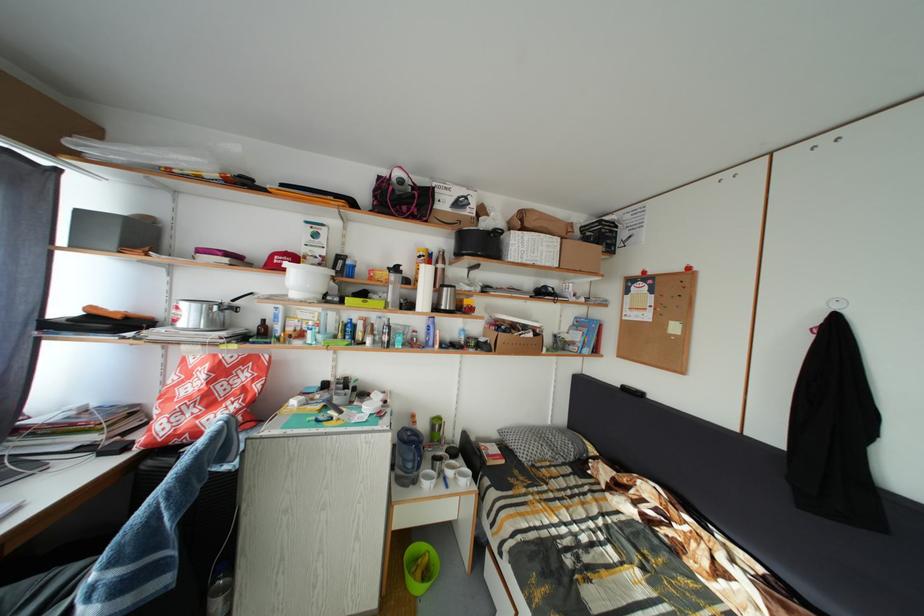
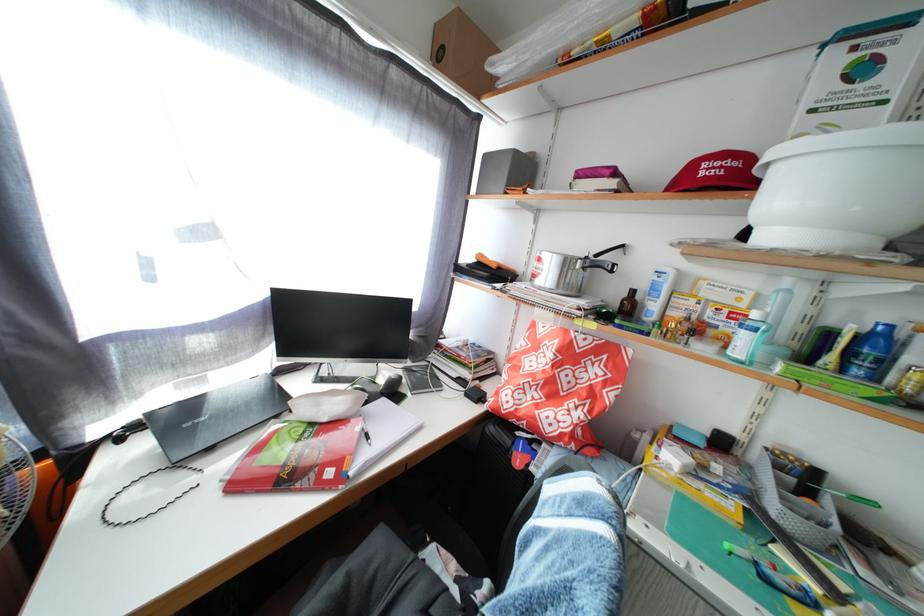
Locate, in the second image, the point that corresponds to (x=88, y=217) in the first image.

(494, 163)